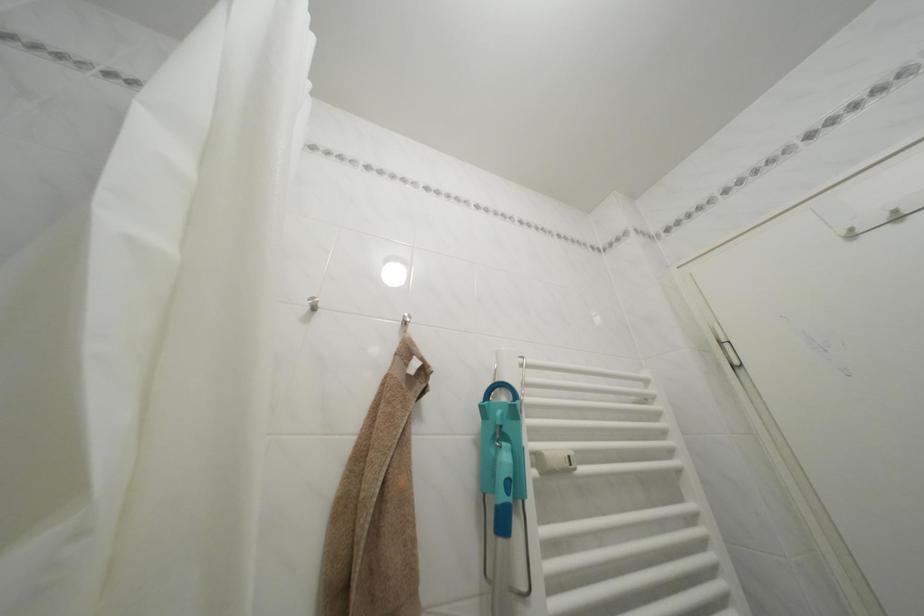
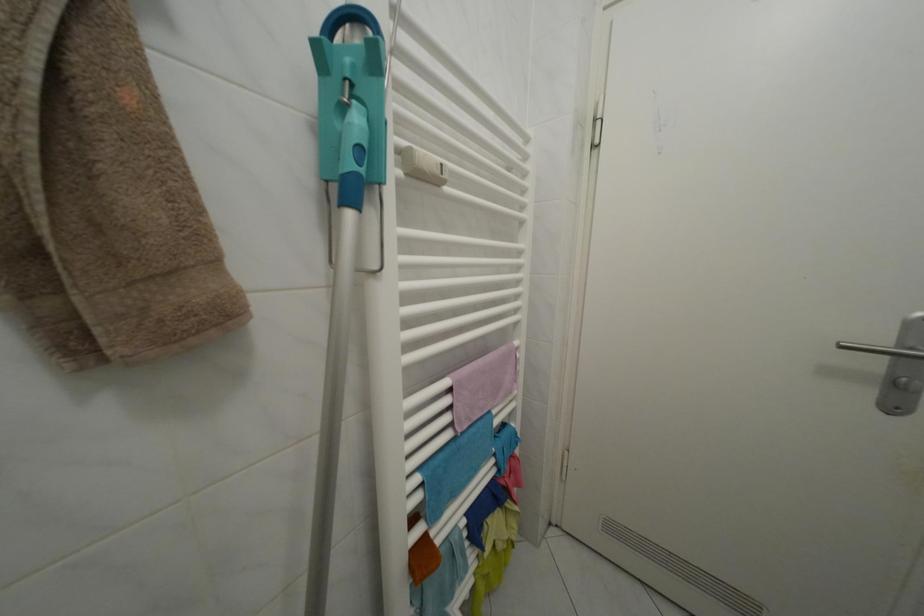
How did the camera likely rotate?

The rotation direction of the camera is right-down.